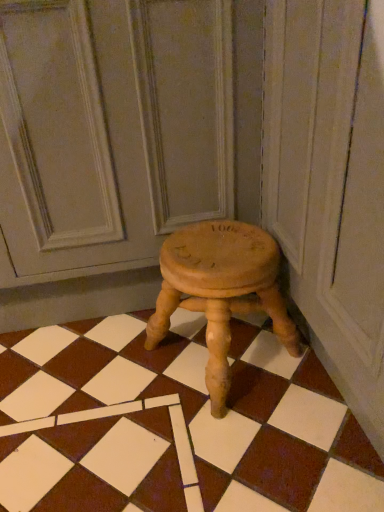
Identify the location of free area in between wooden stool at center and natural wood stool at center. (87, 373).